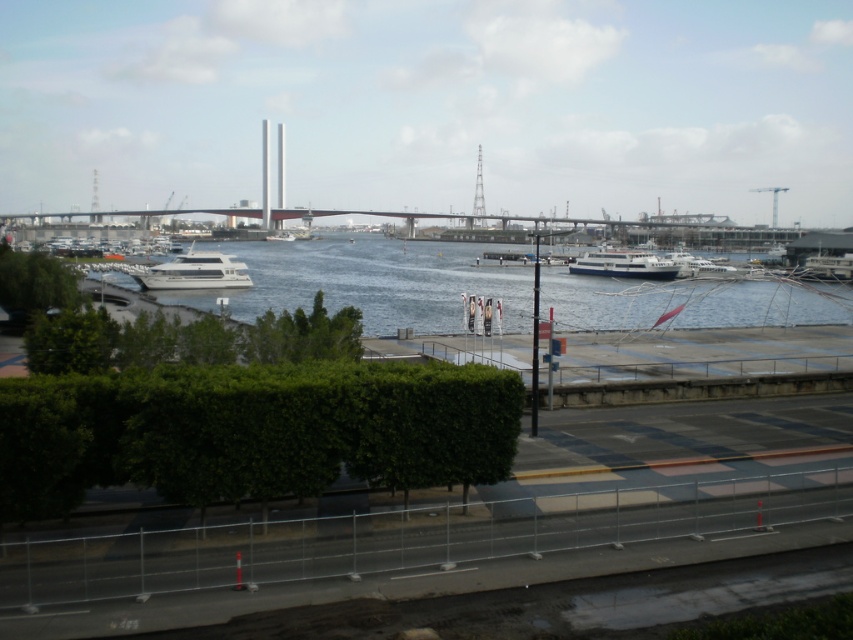
Question: Which object is positioned closest to the concrete bridge at center?

Choices:
 (A) white glossy ferry at center
 (B) green leafy hedge at center
 (C) blue water at center
 (D) green leafy hedge at lower left

Answer: (C)

Question: From the image, what is the correct spatial relationship of green leafy hedge at center in relation to blue water at center?

Choices:
 (A) below
 (B) above

Answer: (A)

Question: Estimate the real-world distances between objects in this image. Which object is farther from the concrete bridge at center?

Choices:
 (A) green leafy hedge at center
 (B) blue water at center
 (C) green leafy hedge at lower left

Answer: (A)

Question: Can you confirm if green leafy hedge at center is positioned below concrete bridge at center?

Choices:
 (A) yes
 (B) no

Answer: (A)

Question: Which point appears farthest from the camera in this image?

Choices:
 (A) (639, 236)
 (B) (611, 262)
 (C) (462, 472)
 (D) (7, 250)

Answer: (A)

Question: Where is green leafy hedge at center located in relation to white glossy boat at center in the image?

Choices:
 (A) left
 (B) right

Answer: (B)